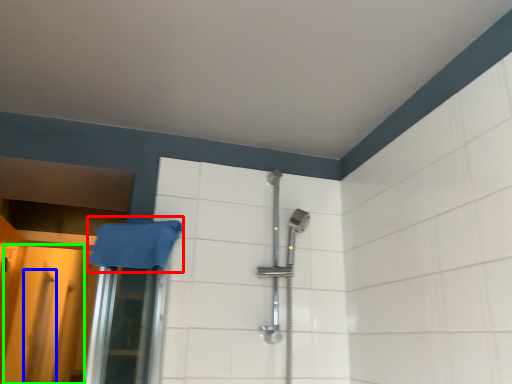
Question: Which object is positioned farthest from bath towel (highlighted by a red box)? Select from screen door (highlighted by a blue box) and screen door (highlighted by a green box).

Choices:
 (A) screen door
 (B) screen door

Answer: (A)